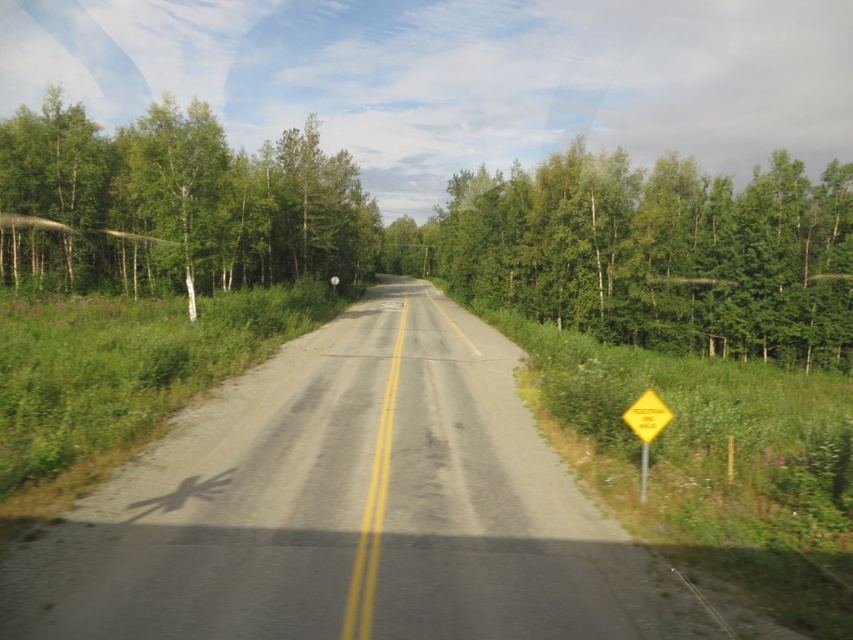
Question: Which point is closer to the camera taking this photo?

Choices:
 (A) (647, 392)
 (B) (815, 268)
 (C) (201, 273)
 (D) (635, 401)

Answer: (D)

Question: Does green leafy tree at left appear under yellow reflective diamond at right?

Choices:
 (A) yes
 (B) no

Answer: (B)

Question: Estimate the real-world distances between objects in this image. Which object is closer to the yellow reflective diamond at right?

Choices:
 (A) green leafy tree at left
 (B) yellow diamond-shaped warning sign at right

Answer: (B)

Question: Considering the real-world distances, which object is closest to the yellow diamond-shaped warning sign at right?

Choices:
 (A) green leafy tree at left
 (B) yellow reflective diamond at right
 (C) green leafy trees at center

Answer: (B)

Question: Is green leafy trees at center wider than green leafy tree at left?

Choices:
 (A) no
 (B) yes

Answer: (B)

Question: From the image, what is the correct spatial relationship of yellow diamond-shaped warning sign at right in relation to yellow reflective diamond at right?

Choices:
 (A) left
 (B) right

Answer: (B)